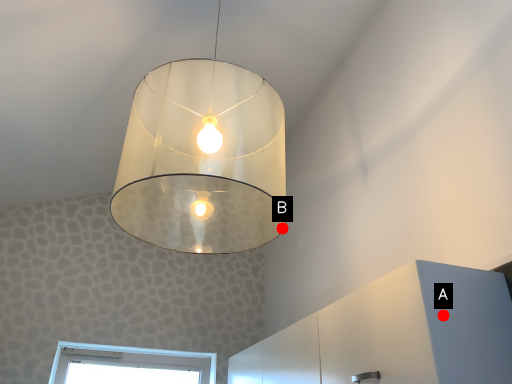
Question: Two points are circled on the image, labeled by A and B beside each circle. Which of the following is the closest to the observer?

Choices:
 (A) A is closer
 (B) B is closer

Answer: (A)